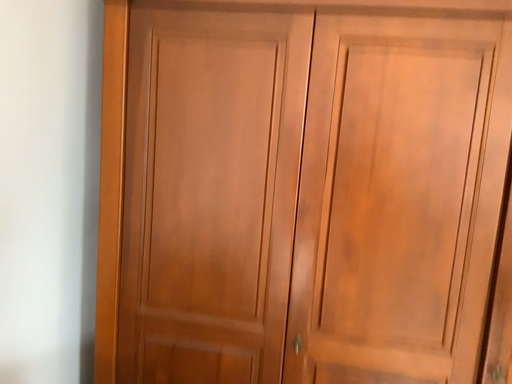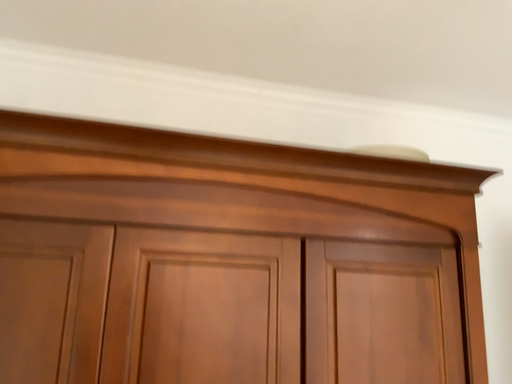
Question: Which way did the camera rotate in the video?

Choices:
 (A) rotated upward
 (B) rotated downward

Answer: (A)